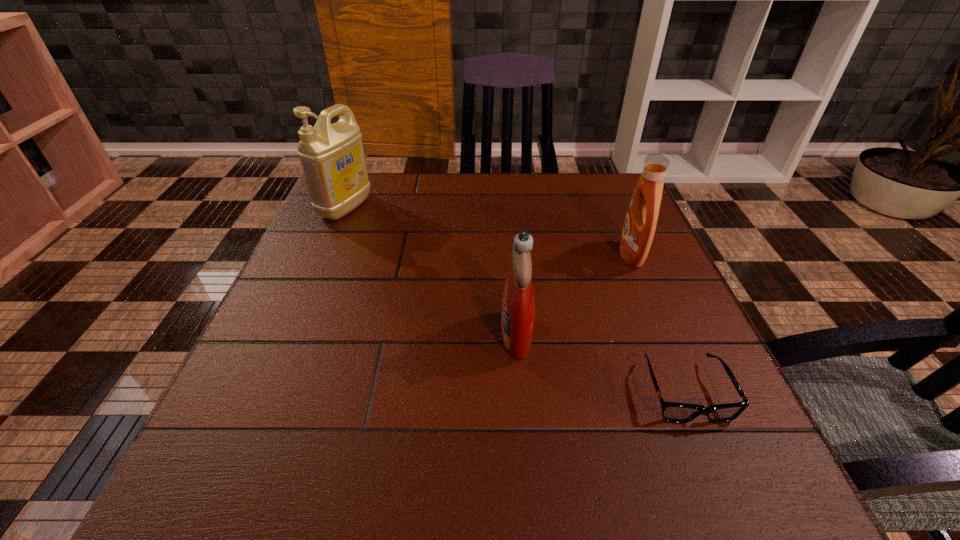
This screenshot has height=540, width=960. Identify the location of free region at the far edge of the desktop. (550, 183).

In the image, there is a desktop. At what (x,y) coordinates should I click in order to perform the action: click on vacant space at the left edge. Please return your answer as a coordinate pair (x, y). Looking at the image, I should click on (311, 331).

Identify the location of free region at the right edge. The height and width of the screenshot is (540, 960). (670, 277).

Identify the location of vacant space at the near left corner of the desktop. (294, 498).

In the image, there is a desktop. At what (x,y) coordinates should I click in order to perform the action: click on vacant space at the far right corner. Please return your answer as a coordinate pair (x, y). The height and width of the screenshot is (540, 960). Looking at the image, I should click on (590, 178).

Find the location of a particular element. The height and width of the screenshot is (540, 960). vacant area between the rightmost detergent and the farthest detergent is located at coordinates (489, 231).

Identify the location of free space between the third nearest object and the nearest detergent. This screenshot has height=540, width=960. (574, 294).

The height and width of the screenshot is (540, 960). What are the coordinates of `free space between the nearest detergent and the rightmost detergent` in the screenshot? It's located at (574, 294).

You are a GUI agent. You are given a task and a screenshot of the screen. Output one action in this format:
    pyautogui.click(x=<x>, y=<y>)
    Task: Click on the vacant space that is in between the third object from right to left and the shortest object
    Image resolution: width=960 pixels, height=540 pixels.
    Given the screenshot: What is the action you would take?
    pyautogui.click(x=601, y=363)

I want to click on free space between the third object from right to left and the sunglasses, so click(601, 363).